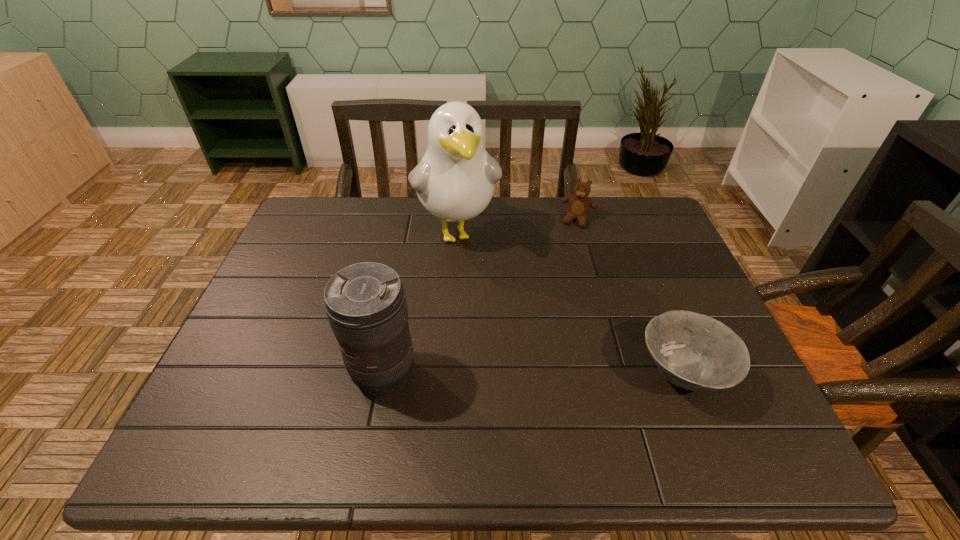
Find the location of a particular element. free space on the desktop that is between the third shortest object and the shortest object and is positioned at the face of the teddy bear is located at coordinates (521, 375).

Locate an element on the screen. This screenshot has height=540, width=960. vacant spot on the desktop that is between the second tallest object and the bowl and is positioned on the beak of the gull is located at coordinates (501, 375).